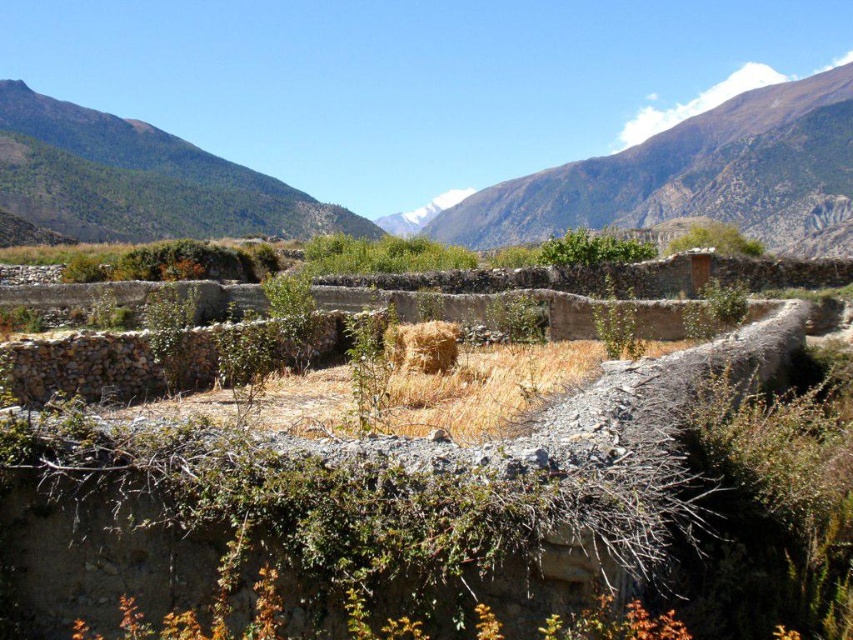
Question: Considering the real-world distances, which object is closest to the yellow straw bale at center?

Choices:
 (A) snowy rocky mountain at upper right
 (B) green textured mountain at left

Answer: (B)

Question: Can you confirm if snowy rocky mountain at upper right is positioned below yellow straw bale at center?

Choices:
 (A) yes
 (B) no

Answer: (B)

Question: Can you confirm if snowy rocky mountain at upper right is positioned to the right of green textured mountain at left?

Choices:
 (A) no
 (B) yes

Answer: (B)

Question: Which object appears closest to the camera in this image?

Choices:
 (A) snowy rocky mountain at upper right
 (B) yellow straw bale at center
 (C) green textured mountain at left

Answer: (B)

Question: Is snowy rocky mountain at upper right above green textured mountain at left?

Choices:
 (A) yes
 (B) no

Answer: (A)

Question: Which of the following is the closest to the observer?

Choices:
 (A) snowy rocky mountain at upper right
 (B) green textured mountain at left
 (C) yellow straw bale at center

Answer: (C)